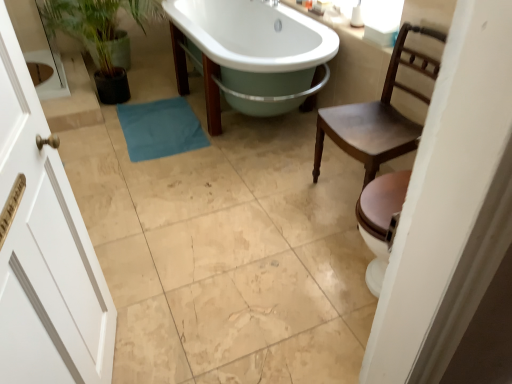
Question: Considering the positions of point (250, 34) and point (142, 26), is point (250, 34) closer or farther from the camera than point (142, 26)?

Choices:
 (A) closer
 (B) farther

Answer: (A)

Question: Looking at the image, does white glossy bathtub at center seem bigger or smaller compared to green matte plant at left?

Choices:
 (A) small
 (B) big

Answer: (B)

Question: Estimate the real-world distances between objects in this image. Which object is farther from the green matte plant at left?

Choices:
 (A) blue fabric bath towel at center
 (B) white glossy bathtub at center
 (C) brown wooden chair at right

Answer: (C)

Question: Estimate the real-world distances between objects in this image. Which object is closer to the white glossy bathtub at center?

Choices:
 (A) brown wooden chair at right
 (B) green matte plant at left
 (C) blue fabric bath towel at center

Answer: (C)